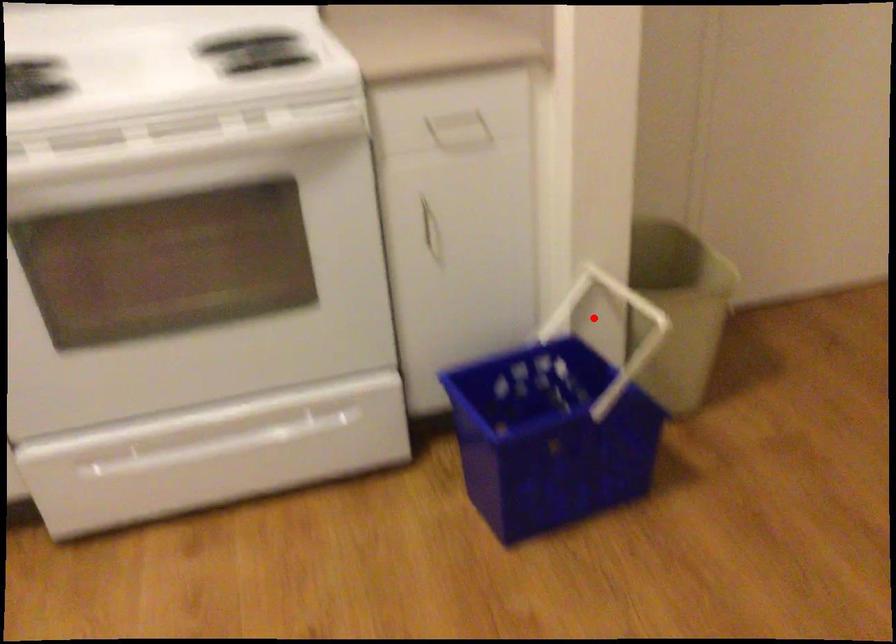
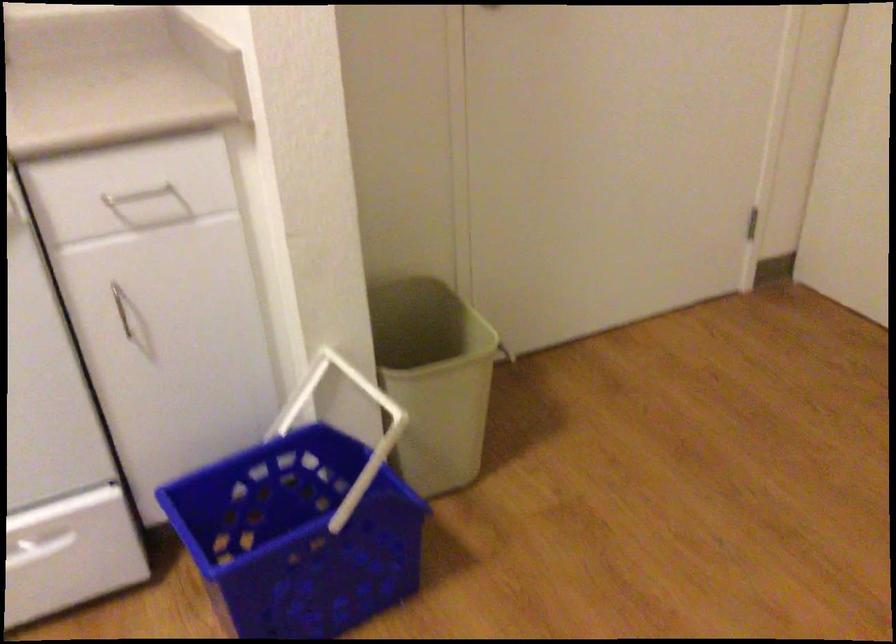
Question: I am providing you with two images of the same scene from different viewpoints. Image1 has a red point marked. In image2, the corresponding 3D location appears at what relative position? Reply with the corresponding letter.

Choices:
 (A) Closer
 (B) Farther

Answer: (A)